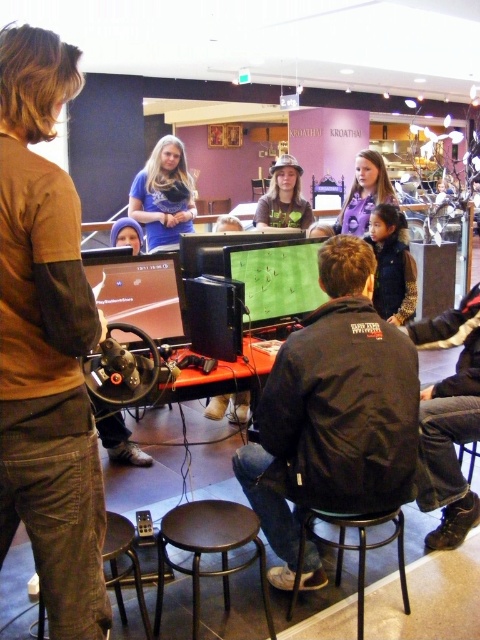
Which is below, black metal stool at lower center or blue fabric hat at center?

black metal stool at lower center is below.

Does black metal stool at lower center have a lesser height compared to blue fabric hat at center?

In fact, black metal stool at lower center may be taller than blue fabric hat at center.

Is point (339, 531) positioned in front of point (119, 243)?

Yes, point (339, 531) is closer to viewer.

Find the location of a particular element. The image size is (480, 640). black metal stool at lower center is located at coordinates (351, 548).

Between point (397, 276) and point (109, 547), which one is positioned in front?

Point (109, 547) is more forward.

At what (x,y) coordinates should I click in order to perform the action: click on dark blue denim vest at center. Please return your answer as a coordinate pair (x, y). The width and height of the screenshot is (480, 640). Looking at the image, I should click on (392, 264).

Who is more forward, [416,272] or [108,547]?

Positioned in front is point [108,547].

Find the location of a particular element. Image resolution: width=480 pixels, height=640 pixels. dark blue denim vest at center is located at coordinates (392, 264).

Consider the image. Can you confirm if dark blue denim vest at center is positioned to the right of blue fabric hat at center?

Yes, dark blue denim vest at center is to the right of blue fabric hat at center.

Does dark blue denim vest at center have a smaller size compared to blue fabric hat at center?

Yes.

Does point (374, 280) come farther from viewer compared to point (113, 241)?

Yes, point (374, 280) is behind point (113, 241).

The height and width of the screenshot is (640, 480). In order to click on dark blue denim vest at center in this screenshot , I will do `click(392, 264)`.